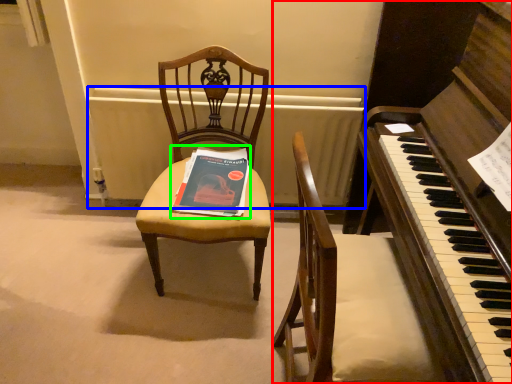
Question: Which is nearer to the harpsichord (highlighted by a red box)? radiator (highlighted by a blue box) or paperback book (highlighted by a green box).

Choices:
 (A) radiator
 (B) paperback book

Answer: (B)